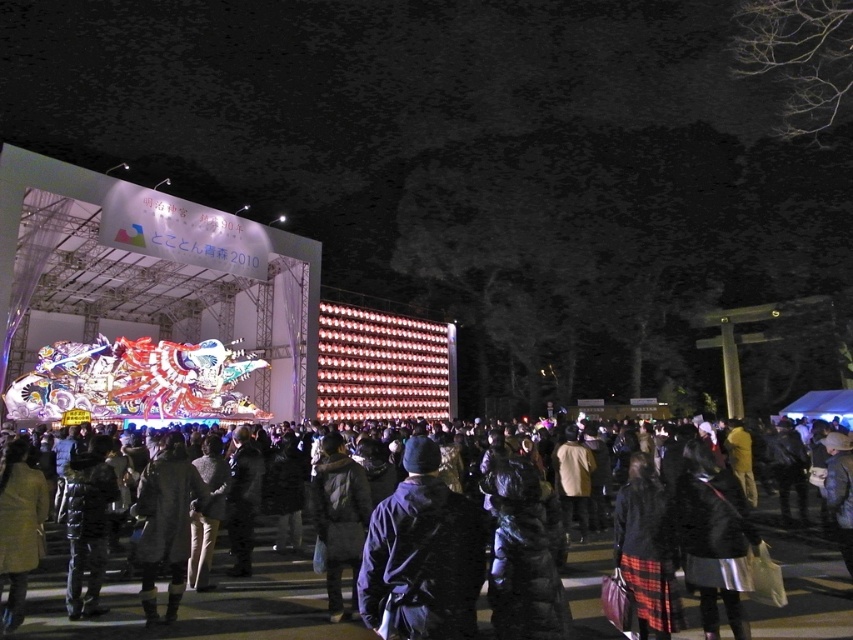
Between dark gray wool coat at center and dark blue jacket at center, which one is positioned lower?

Positioned lower is dark gray wool coat at center.

How far apart are dark gray wool coat at center and dark blue jacket at center?

26.02 feet

Is point (834, 605) behind point (456, 612)?

Yes, it is behind point (456, 612).

Identify the location of dark gray wool coat at center. The width and height of the screenshot is (853, 640). (200, 605).

Can you confirm if dark gray wool coat at center is positioned below dark gray coat at center?

Yes.

Is point (764, 628) behind point (148, 621)?

No, (764, 628) is closer to viewer.

Identify the location of dark gray wool coat at center. This screenshot has height=640, width=853. (200, 605).

Who is more distant from viewer, (477, 588) or (154, 577)?

Point (154, 577)

Does dark blue jacket at center appear over dark gray coat at center?

Indeed, dark blue jacket at center is positioned over dark gray coat at center.

What do you see at coordinates (422, 556) in the screenshot? I see `dark blue jacket at center` at bounding box center [422, 556].

Find the location of a particular element. The height and width of the screenshot is (640, 853). dark blue jacket at center is located at coordinates (422, 556).